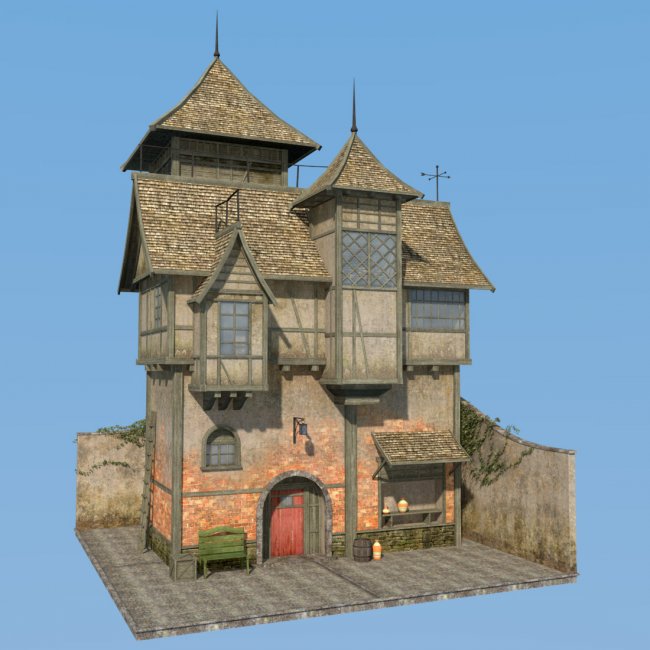
Locate an element on the screen. The image size is (650, 650). window is located at coordinates (366, 266).